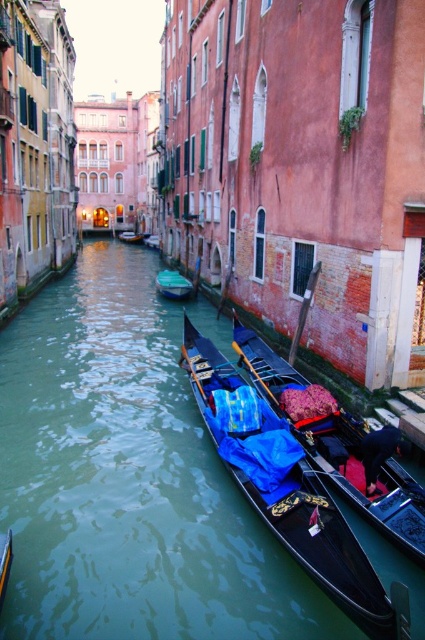
Does black glossy canoe at center have a smaller size compared to green plastic boat at center?

Actually, black glossy canoe at center might be larger than green plastic boat at center.

Locate an element on the screen. Image resolution: width=425 pixels, height=640 pixels. black glossy canoe at center is located at coordinates (339, 449).

Is green smooth water at center bigger than green plastic boat at center?

Correct, green smooth water at center is larger in size than green plastic boat at center.

Which is more to the right, green smooth water at center or green plastic boat at center?

green smooth water at center is more to the right.

Image resolution: width=425 pixels, height=640 pixels. Find the location of `green smooth water at center`. green smooth water at center is located at coordinates (127, 480).

Is point (45, 355) in front of point (387, 502)?

No, it is behind (387, 502).

Which is above, green smooth water at center or black glossy canoe at center?

green smooth water at center is above.

Identify the location of green smooth water at center. This screenshot has width=425, height=640. (127, 480).